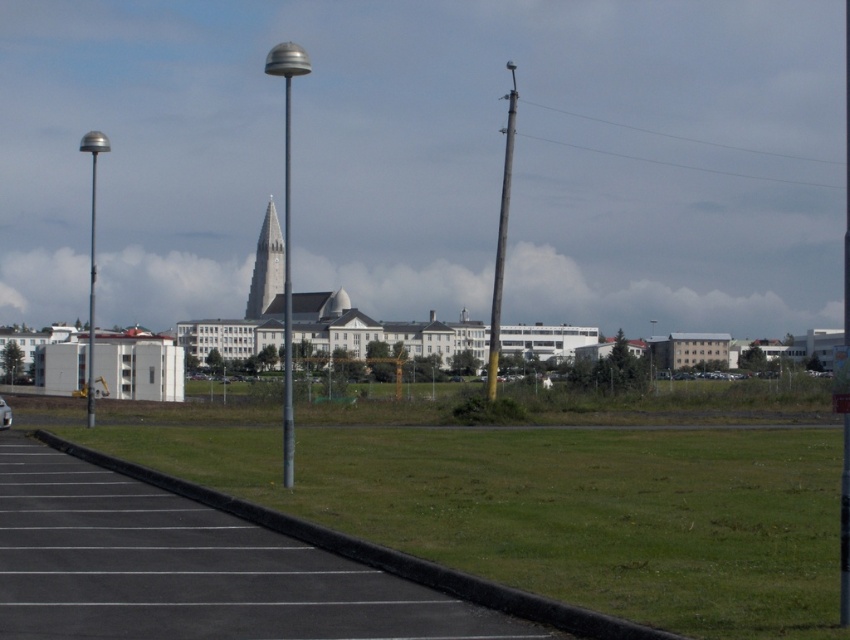
Question: Which object appears closest to the camera in this image?

Choices:
 (A) metallic pole at left
 (B) metallic gray pole at center
 (C) black asphalt parking lot at lower left

Answer: (C)

Question: Which point is farther from the camera taking this photo?

Choices:
 (A) (94, 314)
 (B) (491, 392)
 (C) (100, 132)
 (D) (284, 202)

Answer: (A)

Question: Can you confirm if black asphalt parking lot at lower left is bigger than white glossy car at center?

Choices:
 (A) yes
 (B) no

Answer: (A)

Question: Can you confirm if black asphalt parking lot at lower left is bigger than polished silver pole at center?

Choices:
 (A) yes
 (B) no

Answer: (B)

Question: Which object appears farthest from the camera in this image?

Choices:
 (A) metallic pole at left
 (B) polished silver pole at center

Answer: (A)

Question: Can you confirm if polished silver pole at center is positioned to the right of smooth gray spire at center?

Choices:
 (A) no
 (B) yes

Answer: (B)